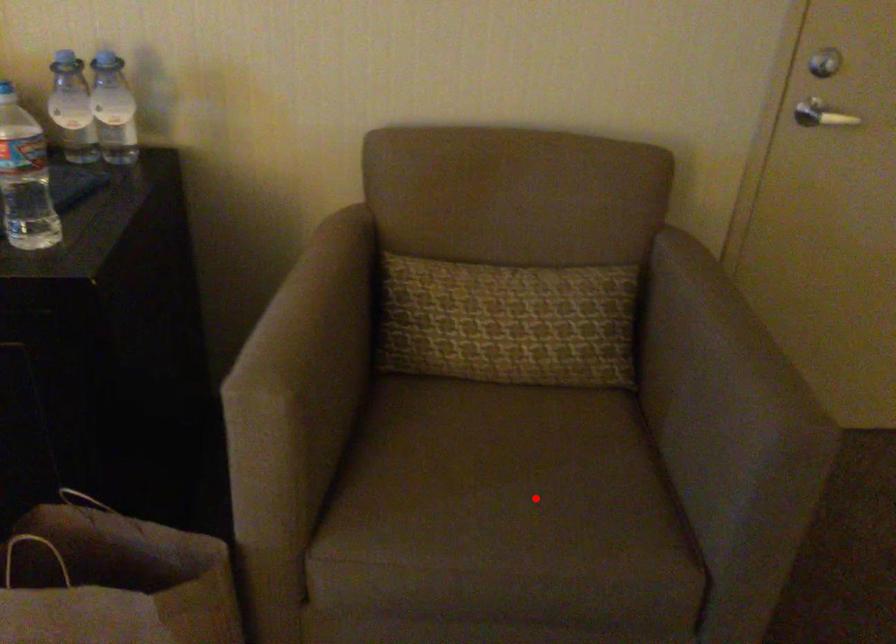
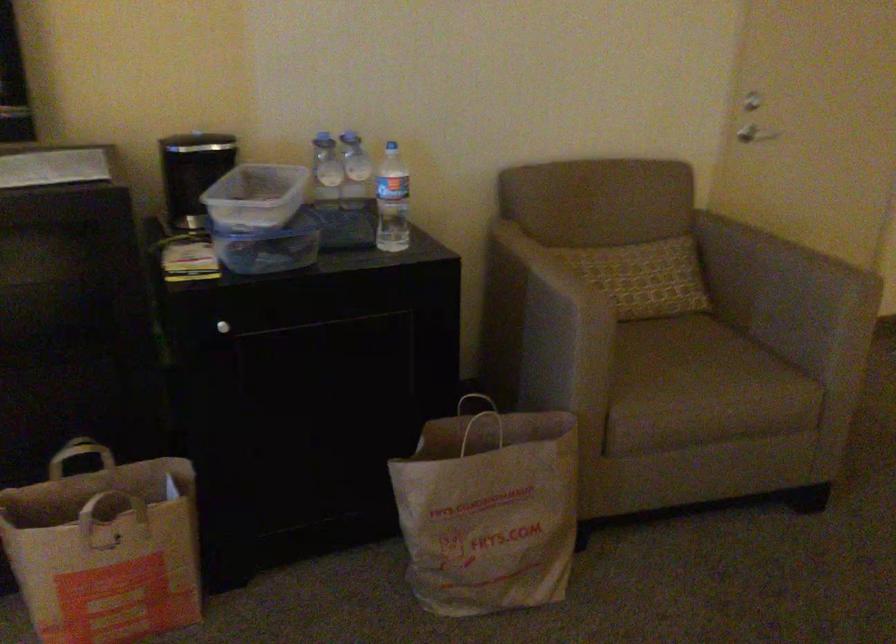
Question: I am providing you with two images of the same scene from different viewpoints. Image1 has a red point marked. In image2, the corresponding 3D location appears at what relative position? Reply with the corresponding letter.

Choices:
 (A) Closer
 (B) Farther

Answer: (B)